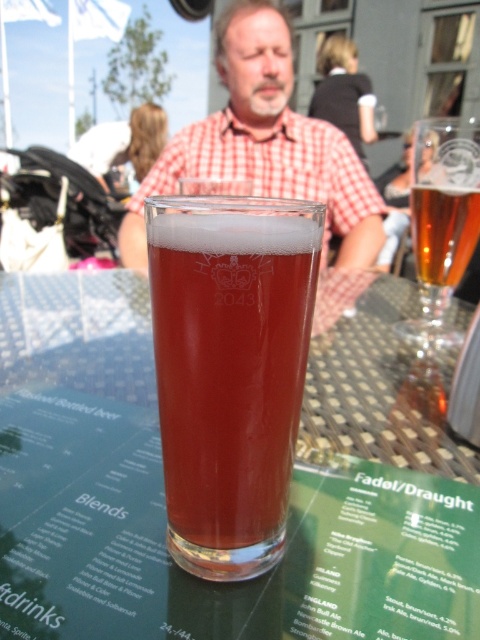
Question: Does translucent glass at center have a greater width compared to amber glass beer at upper right?

Choices:
 (A) yes
 (B) no

Answer: (A)

Question: Does translucent glass at center appear under clear glass beer at upper right?

Choices:
 (A) no
 (B) yes

Answer: (B)

Question: Which of the following is the closest to the observer?

Choices:
 (A) (450, 129)
 (B) (69, 324)
 (C) (428, 186)

Answer: (A)

Question: Does translucent glass at center appear on the right side of red checkered shirt at center?

Choices:
 (A) no
 (B) yes

Answer: (A)

Question: Which point is farther from the camera taking this photo?

Choices:
 (A) (66, 572)
 (B) (444, 241)
 (C) (348, 234)

Answer: (C)

Question: Which of the following is the closest to the observer?

Choices:
 (A) (133, 253)
 (B) (156, 506)

Answer: (B)